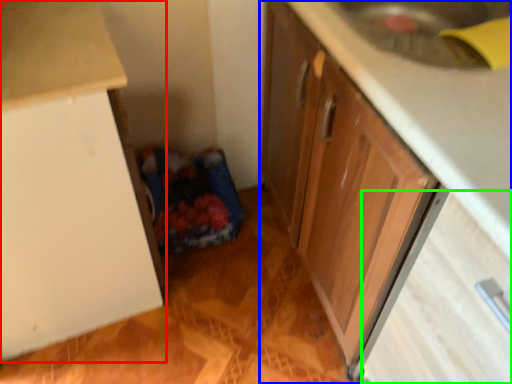
Question: Estimate the real-world distances between objects in this image. Which object is closer to cabinetry (highlighted by a red box), cabinetry (highlighted by a blue box) or drawer (highlighted by a green box)?

Choices:
 (A) cabinetry
 (B) drawer

Answer: (A)